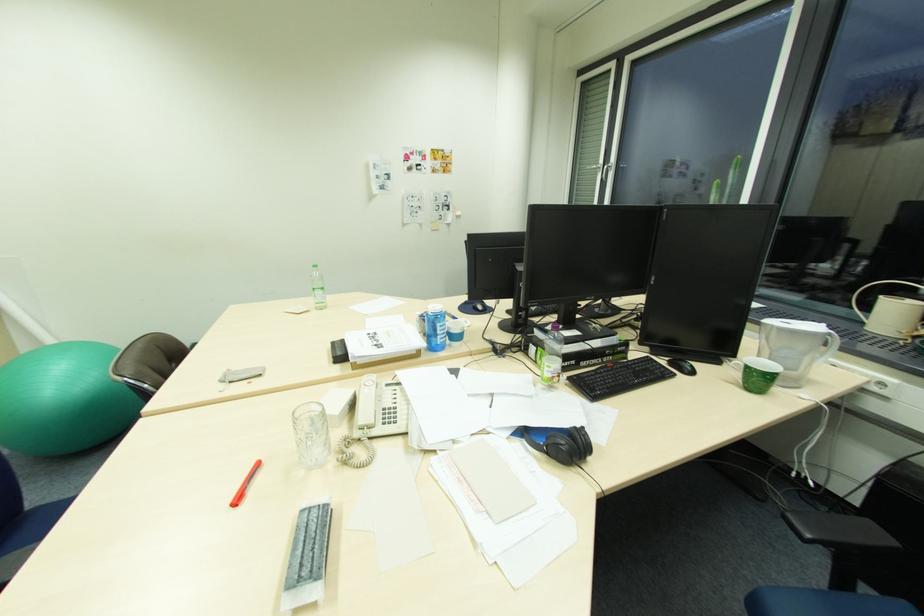
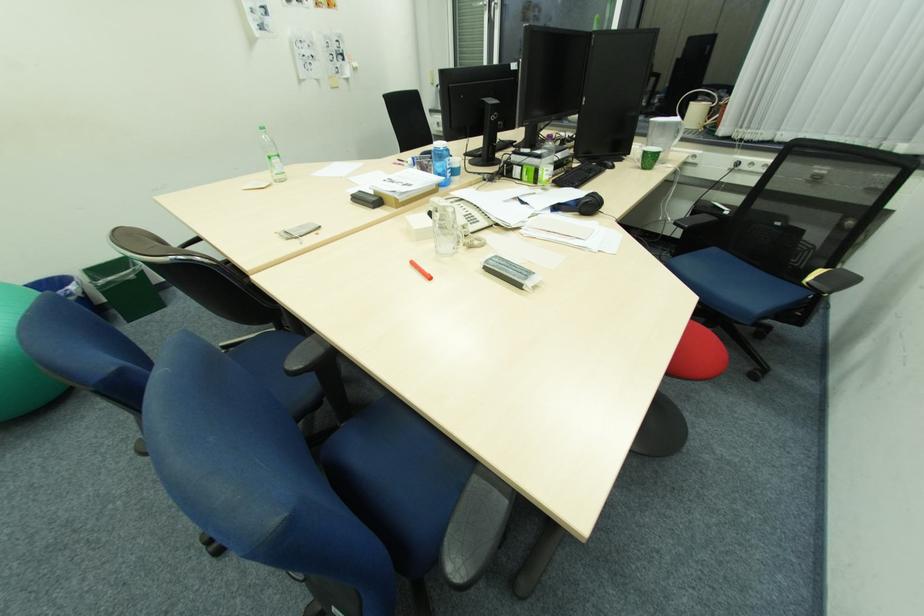
Find the pixel in the second image that matches pixel 529 432 in the first image.

(563, 209)